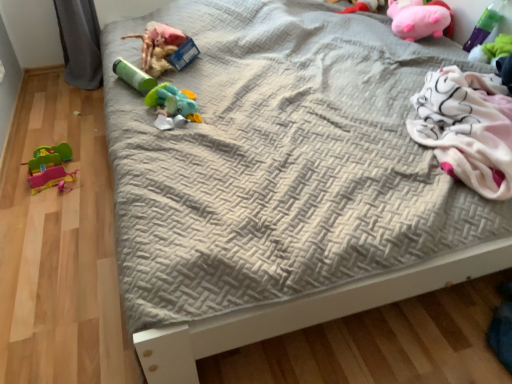
Question: Considering the positions of green matte cylinder at center, which is the 2th toy from left to right, and pink plush toy at upper right, which is the third toy in right-to-left order, in the image, is green matte cylinder at center, which is the 2th toy from left to right, bigger or smaller than pink plush toy at upper right, which is the third toy in right-to-left order,?

Choices:
 (A) small
 (B) big

Answer: (A)

Question: Looking at their shapes, would you say green matte cylinder at center, which is the 2th toy from left to right, is wider or thinner than pink plush toy at upper right, which is the third toy in right-to-left order?

Choices:
 (A) wide
 (B) thin

Answer: (B)

Question: Based on their relative distances, which object is nearer to the matte green tube at upper left, marked as the fifth toy in a right-to-left arrangement?

Choices:
 (A) rubberized green and blue toy at center, the fourth toy in the left-to-right sequence
 (B) green plastic toy at upper right, the 7th toy positioned from the left
 (C) pink plush pig at upper right, which is the 6th toy from left to right
 (D) pink plush toy at upper right, which appears as the fifth toy when viewed from the left
 (E) green matte cylinder at center, which is the 2th toy from left to right

Answer: (E)

Question: Estimate the real-world distances between objects in this image. Which object is farther from the matte green tube at upper left, marked as the fifth toy in a right-to-left arrangement?

Choices:
 (A) rubberized green and blue toy at center, the fourth toy in the left-to-right sequence
 (B) green plastic toy at upper right, arranged as the 1th toy when viewed from the right
 (C) rubber duck at left, acting as the first toy starting from the left
 (D) pink plush toy at upper right, which appears as the fifth toy when viewed from the left
 (E) green matte cylinder at center, the sixth toy from the right

Answer: (B)